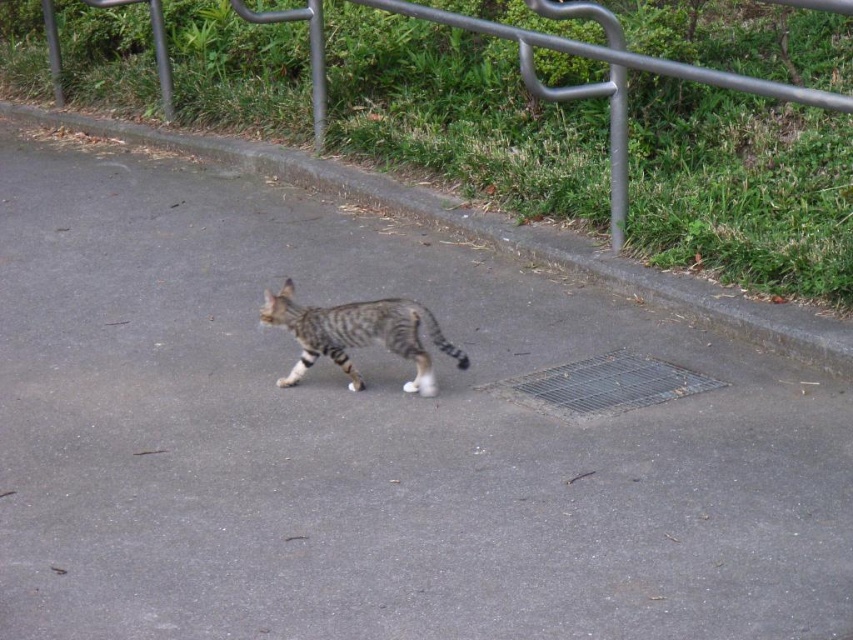
You are standing on the pavement and see the brushed metal fence at upper center and the striped fur cat at center. Which object is closer to you?

The brushed metal fence at upper center is closer to you because it is positioned further to the viewer than the striped fur cat at center.

Consider the image. You are standing at the camera position and want to walk towards the kitten. Which direction should you move relative to the brushed metal fence at upper center?

You should move away from the brushed metal fence at upper center because the kitten is walking away from the camera, and the fence is located at upper center, so moving away from it would lead you towards the kitten.